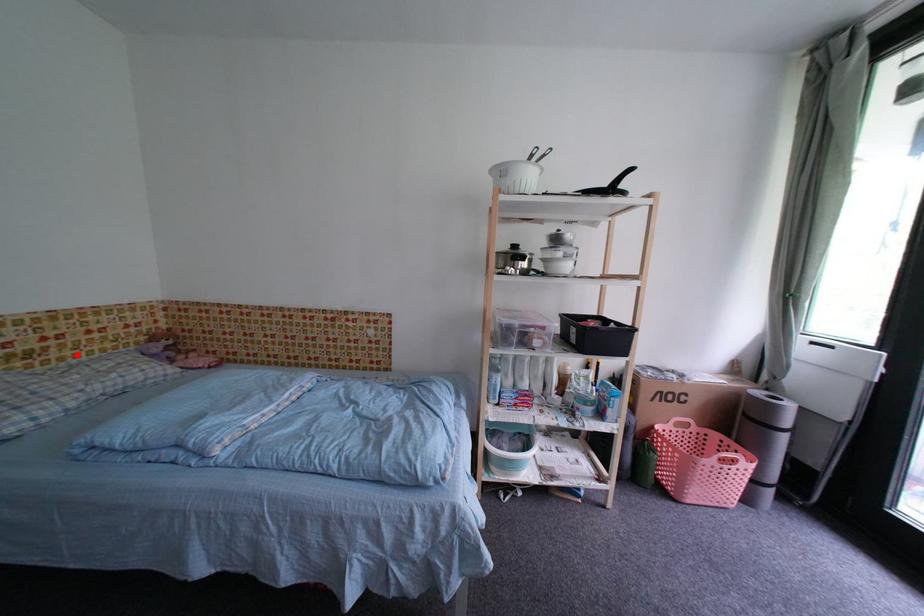
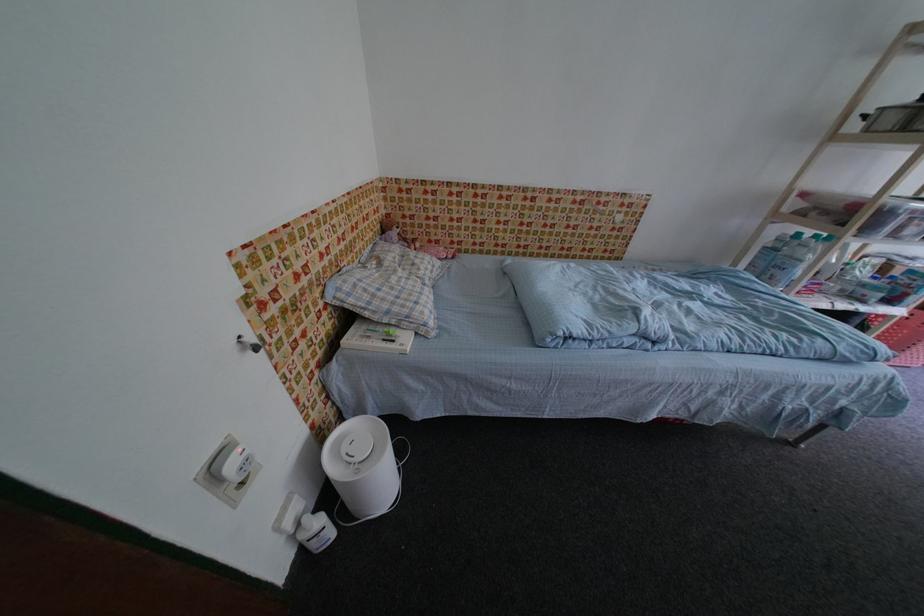
Question: A red point is marked in image1. In image2, is the corresponding 3D point closer to the camera or farther? Reply with the corresponding letter.

Choices:
 (A) The corresponding 3D point is closer.
 (B) The corresponding 3D point is farther.

Answer: (A)